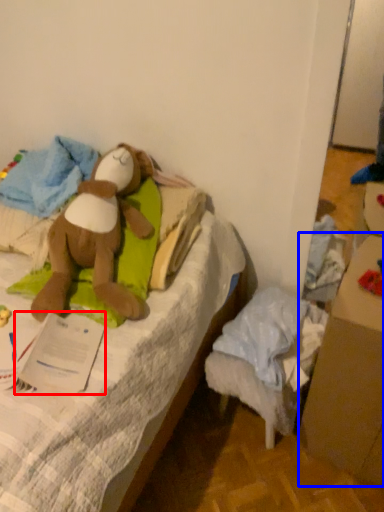
Question: Which object is further to the camera taking this photo, paper (highlighted by a red box) or cardboard box (highlighted by a blue box)?

Choices:
 (A) paper
 (B) cardboard box

Answer: (A)